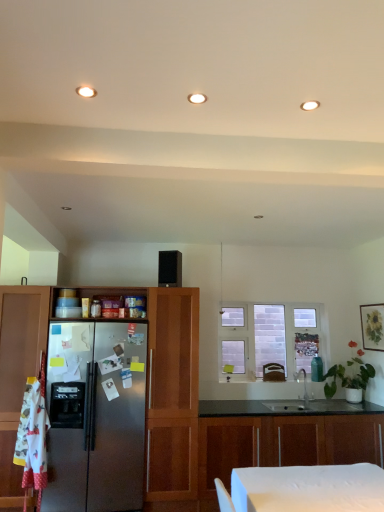
Question: Is matte wooden picture frame at upper right shorter than brown leather swivel chair at center?

Choices:
 (A) yes
 (B) no

Answer: (B)

Question: Is the position of matte wooden picture frame at upper right more distant than that of brown leather swivel chair at center?

Choices:
 (A) yes
 (B) no

Answer: (B)

Question: Would you say matte wooden picture frame at upper right is a long distance from brown leather swivel chair at center?

Choices:
 (A) yes
 (B) no

Answer: (A)

Question: Would you say matte wooden picture frame at upper right contains brown leather swivel chair at center?

Choices:
 (A) no
 (B) yes

Answer: (A)

Question: From a real-world perspective, is matte wooden picture frame at upper right below brown leather swivel chair at center?

Choices:
 (A) no
 (B) yes

Answer: (A)

Question: Is black matte speaker at center wider or thinner than wooden cabinets at center, which is the second cabinetry from top to bottom?

Choices:
 (A) wide
 (B) thin

Answer: (B)

Question: Is point (157, 284) closer or farther from the camera than point (238, 440)?

Choices:
 (A) farther
 (B) closer

Answer: (A)

Question: From a real-world perspective, is black matte speaker at center positioned above or below wooden cabinets at center, which is the second cabinetry from top to bottom?

Choices:
 (A) below
 (B) above

Answer: (B)

Question: Is black matte speaker at center inside or outside of wooden cabinets at center, placed as the 1th cabinetry when sorted from bottom to top?

Choices:
 (A) outside
 (B) inside

Answer: (A)

Question: Looking at their shapes, would you say brown leather swivel chair at center is wider or thinner than wooden cabinets at center, placed as the 1th cabinetry when sorted from bottom to top?

Choices:
 (A) thin
 (B) wide

Answer: (A)

Question: From the image's perspective, relative to wooden cabinets at center, which is the second cabinetry from top to bottom, is brown leather swivel chair at center above or below?

Choices:
 (A) above
 (B) below

Answer: (A)

Question: Considering the relative positions of brown leather swivel chair at center and wooden cabinets at center, placed as the 1th cabinetry when sorted from bottom to top, in the image provided, is brown leather swivel chair at center to the left or to the right of wooden cabinets at center, placed as the 1th cabinetry when sorted from bottom to top,?

Choices:
 (A) left
 (B) right

Answer: (A)

Question: Would you say brown leather swivel chair at center is inside or outside wooden cabinets at center, placed as the 1th cabinetry when sorted from bottom to top?

Choices:
 (A) outside
 (B) inside

Answer: (A)

Question: From the image's perspective, is matte wooden picture frame at upper right positioned above or below white brick window at center?

Choices:
 (A) below
 (B) above

Answer: (B)

Question: In terms of width, does matte wooden picture frame at upper right look wider or thinner when compared to white brick window at center?

Choices:
 (A) wide
 (B) thin

Answer: (B)